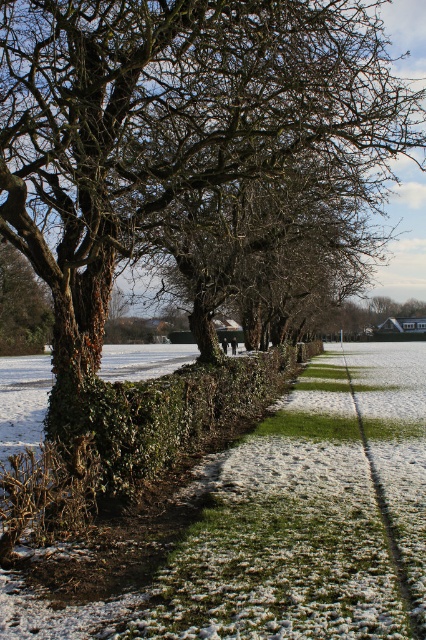
Question: Which object appears closest to the camera in this image?

Choices:
 (A) green grass at center
 (B) green leafy hedge at center
 (C) green leafy tree at upper left

Answer: (B)

Question: Can you confirm if green leafy hedge at center is wider than green leafy tree at upper left?

Choices:
 (A) no
 (B) yes

Answer: (B)

Question: Estimate the real-world distances between objects in this image. Which object is closer to the green leafy hedge at center?

Choices:
 (A) green grass at center
 (B) green leafy tree at upper left

Answer: (A)

Question: Does green leafy tree at upper left lie in front of green grass at center?

Choices:
 (A) no
 (B) yes

Answer: (A)

Question: Is green leafy tree at upper left behind green grass at center?

Choices:
 (A) no
 (B) yes

Answer: (B)

Question: Among these objects, which one is nearest to the camera?

Choices:
 (A) green grass at center
 (B) green leafy tree at upper left
 (C) green leafy hedge at center

Answer: (C)